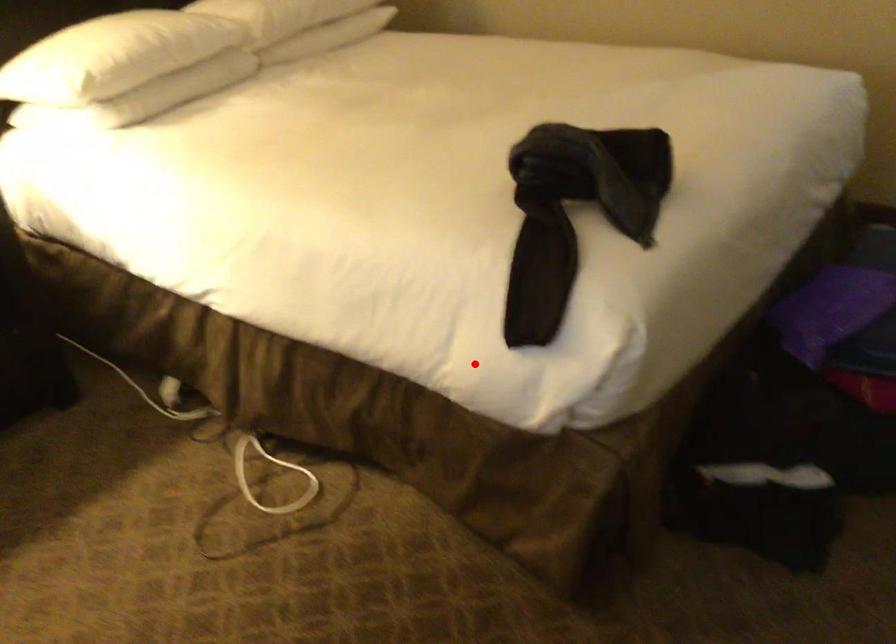
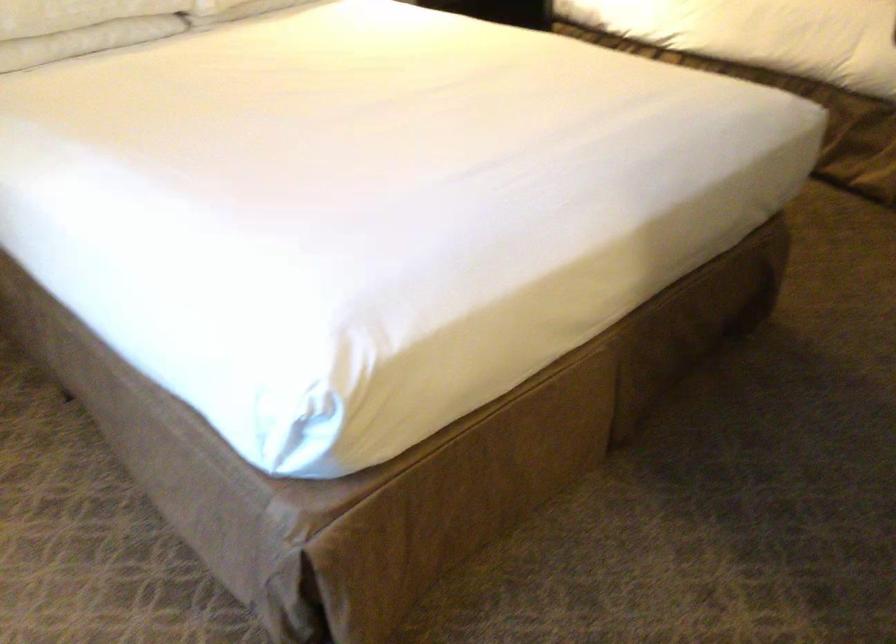
Question: I am providing you with two images of the same scene from different viewpoints. A red point is shown in image1. For the corresponding object point in image2, is it positioned nearer or farther from the camera?

Choices:
 (A) Nearer
 (B) Farther

Answer: (B)